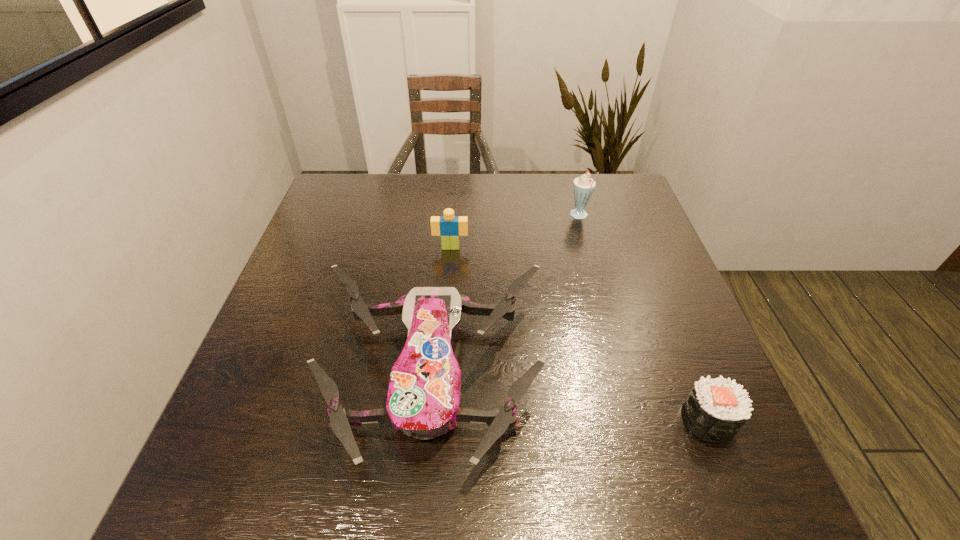
The width and height of the screenshot is (960, 540). I want to click on object identified as the closest to the shortest object, so click(423, 399).

Find the location of `vacant space that satisfies the following two spatial constraints: 1. on the face of the Lego; 2. on the right side of the shortest object`. vacant space that satisfies the following two spatial constraints: 1. on the face of the Lego; 2. on the right side of the shortest object is located at coordinates point(438,421).

Locate an element on the screen. This screenshot has width=960, height=540. free space that satisfies the following two spatial constraints: 1. on the straw side of the farthest object; 2. on the front-facing side of the drone is located at coordinates (622, 375).

Identify the location of vacant region that satisfies the following two spatial constraints: 1. on the straw side of the milkshake; 2. on the back side of the shortest object. Image resolution: width=960 pixels, height=540 pixels. (635, 421).

The height and width of the screenshot is (540, 960). I want to click on free region that satisfies the following two spatial constraints: 1. on the straw side of the second object from right to left; 2. on the left side of the sushi, so click(635, 421).

Find the location of `vacant space that satisfies the following two spatial constraints: 1. on the straw side of the milkshake; 2. on the front-facing side of the drone`. vacant space that satisfies the following two spatial constraints: 1. on the straw side of the milkshake; 2. on the front-facing side of the drone is located at coordinates (622, 375).

Where is `free location that satisfies the following two spatial constraints: 1. on the straw side of the tallest object; 2. on the front-facing side of the drone`? free location that satisfies the following two spatial constraints: 1. on the straw side of the tallest object; 2. on the front-facing side of the drone is located at coordinates (x=622, y=375).

Find the location of a particular element. This screenshot has height=540, width=960. vacant space that satisfies the following two spatial constraints: 1. on the straw side of the second object from right to left; 2. on the back side of the sushi is located at coordinates (635, 421).

Where is `free space that satisfies the following two spatial constraints: 1. on the straw side of the tallest object; 2. on the back side of the sushi`? The width and height of the screenshot is (960, 540). free space that satisfies the following two spatial constraints: 1. on the straw side of the tallest object; 2. on the back side of the sushi is located at coordinates (635, 421).